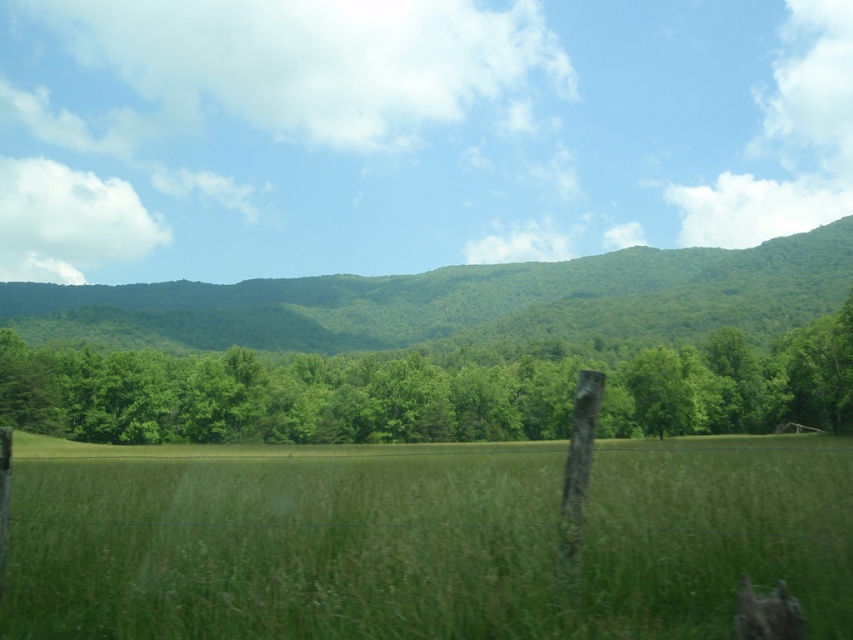
You are standing in the rural landscape and want to walk from the green grassy field at center to the green leafy forest at center. Which direction should you walk to reach the forest?

The green grassy field at center is positioned under the green leafy forest at center, so you should walk upward to reach the forest.

Looking at this image, you are an environmental scientist analyzing the image. You need to determine which of the two green leafy tree at center or green leafy forest at center covers a smaller area in the image. Which one would you conclude?

The green leafy tree at center occupies less space than green leafy forest at center, so the green leafy tree at center covers a smaller area in the image.

You are standing in the middle of the grassy field and see the green leafy tree at center and the green leafy forest at center. Which one is closer to your current position?

The green leafy tree at center is closer to your current position because it is to the left of the green leafy forest at center.